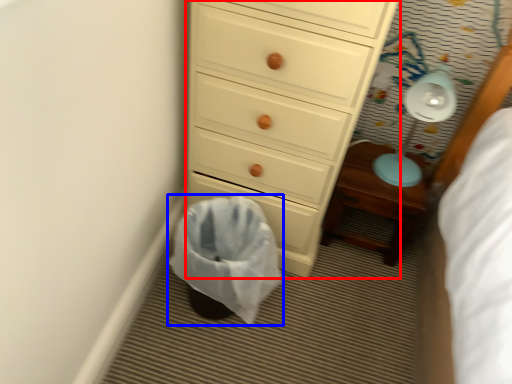
Question: Which point is further to the camera, chest of drawers (highlighted by a red box) or laundry basket (highlighted by a blue box)?

Choices:
 (A) chest of drawers
 (B) laundry basket

Answer: (B)